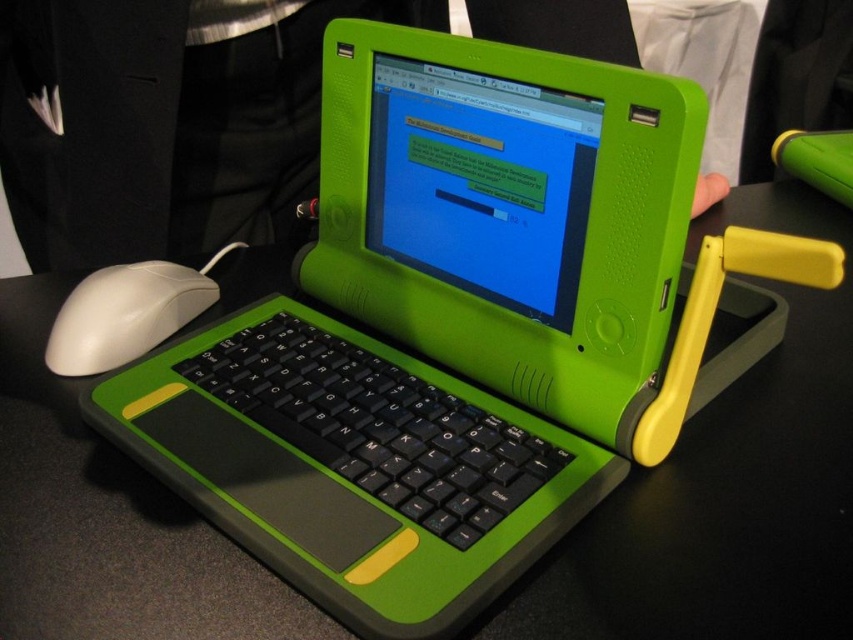
Question: Is black rubberized keyboard at center wider than white matte mouse at left?

Choices:
 (A) no
 (B) yes

Answer: (B)

Question: Does black matte table at center appear on the right side of white matte mouse at left?

Choices:
 (A) yes
 (B) no

Answer: (A)

Question: Which of the following is the closest to the observer?

Choices:
 (A) (569, 627)
 (B) (440, 449)

Answer: (A)

Question: Does black matte table at center appear under white matte mouse at left?

Choices:
 (A) yes
 (B) no

Answer: (A)

Question: Which object is positioned closest to the black matte table at center?

Choices:
 (A) white matte mouse at left
 (B) black rubberized keyboard at center

Answer: (B)

Question: Based on their relative distances, which object is nearer to the black matte table at center?

Choices:
 (A) black rubberized keyboard at center
 (B) white matte mouse at left

Answer: (A)